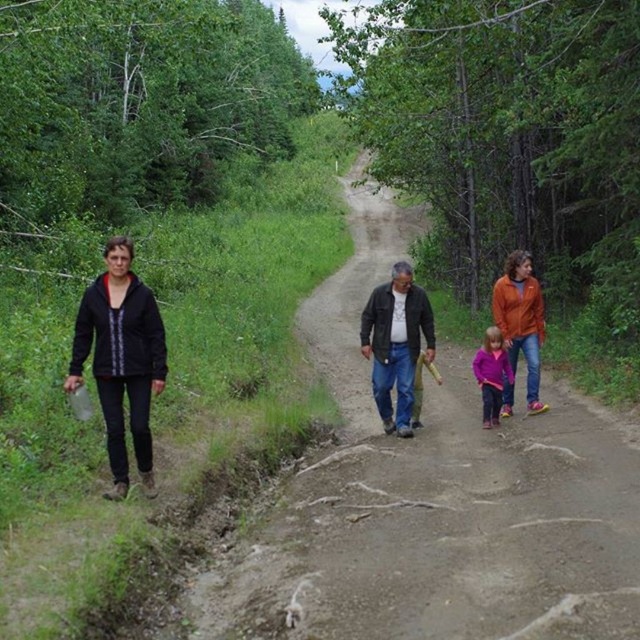
You are a photographer trying to capture a group photo of the dark brown leather jacket at center and the orange fleece jacket at center. Since you want both jackets to appear equally tall in the photo, which jacket should you move closer to the camera?

The dark brown leather jacket at center is not as tall as orange fleece jacket at center. To make them appear equally tall in the photo, you should move the dark brown leather jacket at center closer to the camera so that its image size increases to match the orange fleece jacket at center.